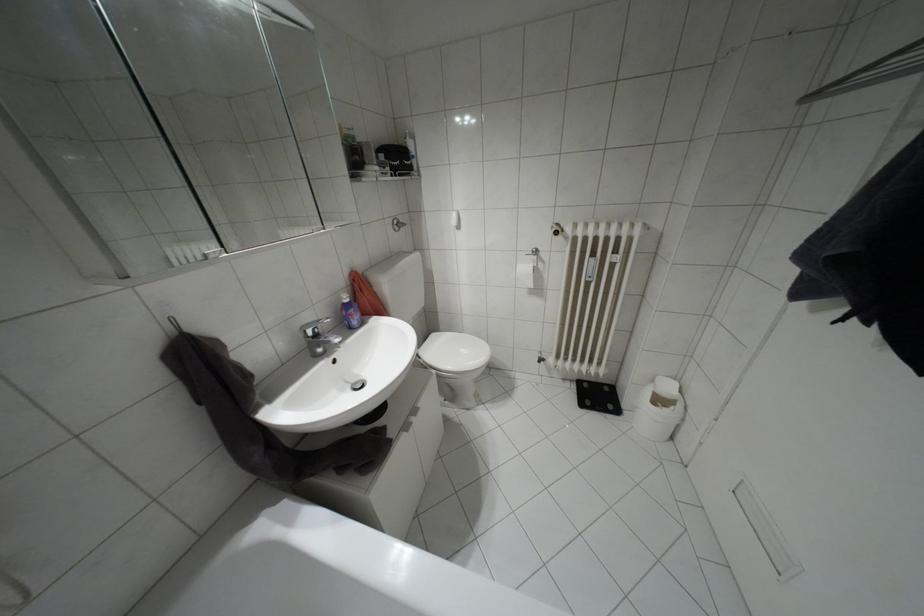
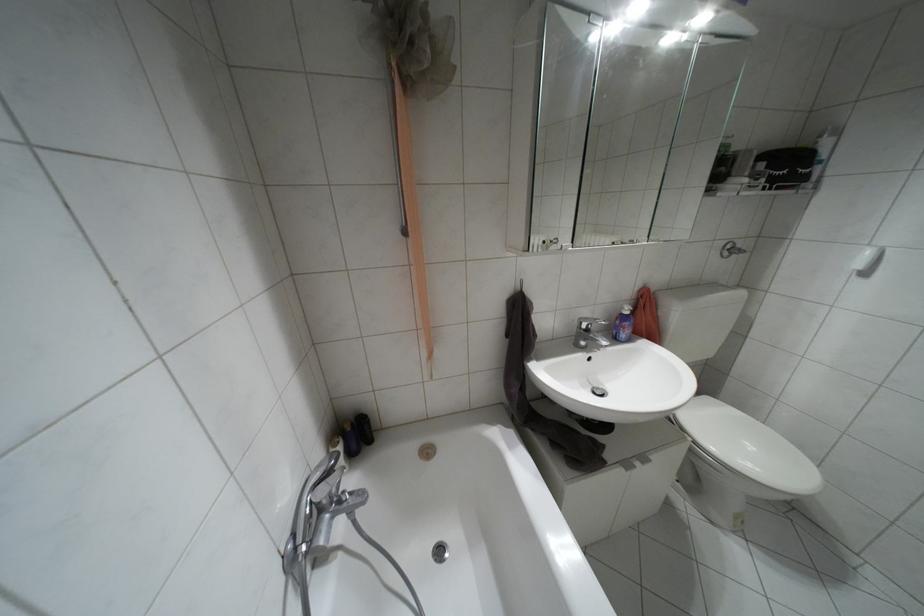
In the second image, find the point that corresponds to (315,334) in the first image.

(587, 330)